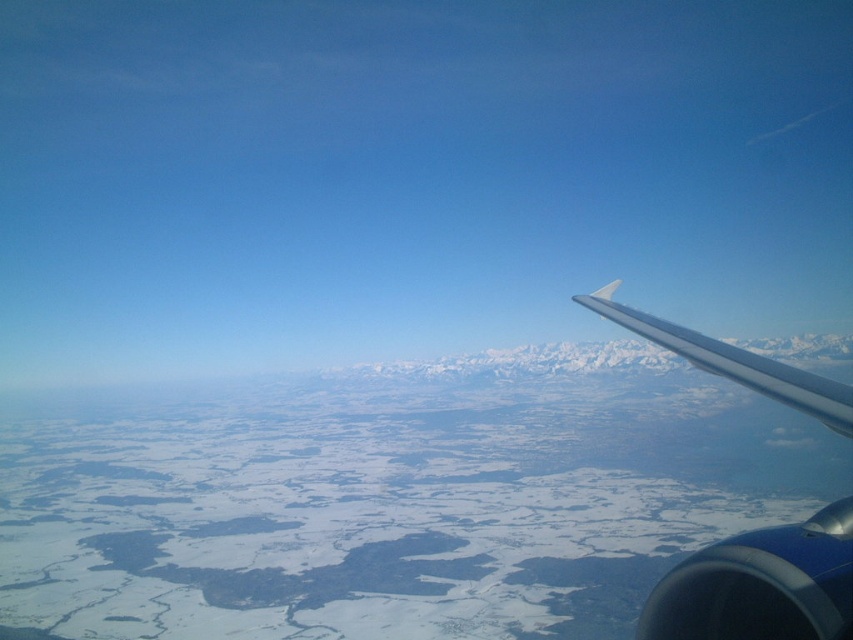
Is metallic silver wing at right in front of white glossy wing at upper right?

Yes, it is.

Consider the image. Is metallic silver wing at right to the right of white glossy wing at upper right from the viewer's perspective?

Incorrect, metallic silver wing at right is not on the right side of white glossy wing at upper right.

Does point (798, 381) lie behind point (730, 348)?

No, it is in front of (730, 348).

Find the location of `metallic silver wing at right`. metallic silver wing at right is located at coordinates (759, 586).